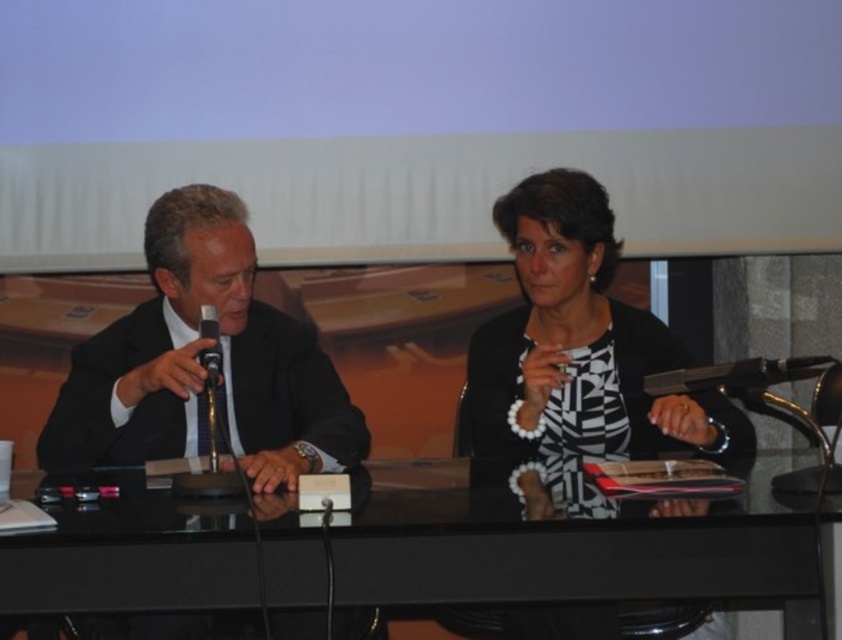
You are organizing a small event and need to ensure that the black plastic microphone at left can fit into a storage box that currently holds the black and white striped blouse at center. Based on the image, will the microphone fit?

The black and white striped blouse at center is bigger than the black plastic microphone at left, so the microphone should fit into the storage box as long as the blouse is removed or the box is large enough to accommodate both items.

From the picture: You are attending a virtual meeting and need to identify the speaker. Based on the image, which object is closer to the left side of the screen between the black and white striped blouse at center and the black plastic microphone at left?

The black plastic microphone at left is closer to the left side of the screen because it is positioned to the left of the black and white striped blouse at center.